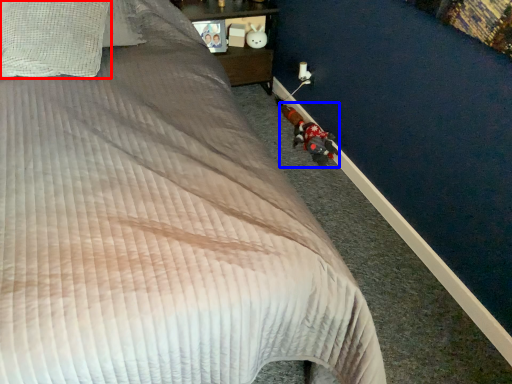
Question: Which point is further to the camera, pillow (highlighted by a red box) or toy (highlighted by a blue box)?

Choices:
 (A) pillow
 (B) toy

Answer: (B)